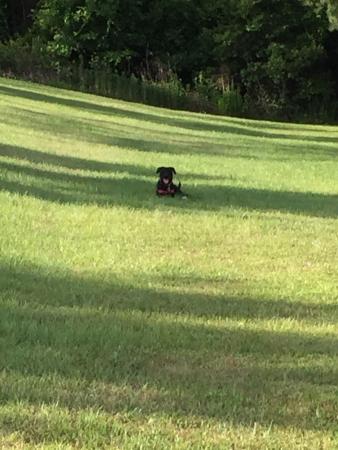
The width and height of the screenshot is (338, 450). What are the coordinates of `corner` in the screenshot? It's located at (305, 441).